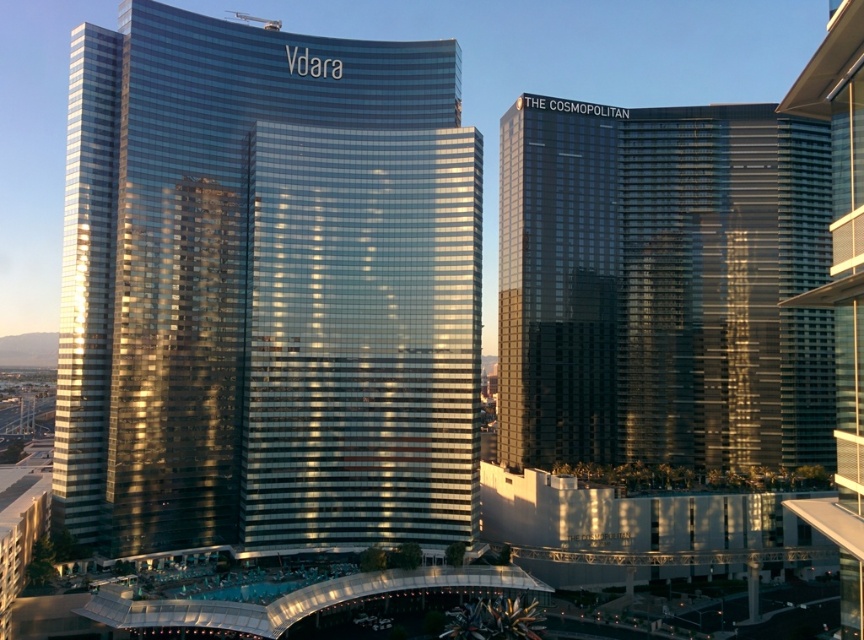
Does shiny glass building at center have a greater height compared to shiny glass building at right?

Yes.

Between shiny glass building at center and shiny glass building at right, which one is positioned lower?

shiny glass building at right

Image resolution: width=864 pixels, height=640 pixels. I want to click on shiny glass building at center, so click(x=265, y=289).